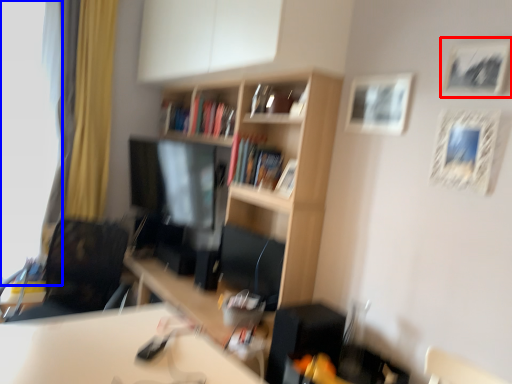
Question: Which of the following is the closest to the observer, picture frame (highlighted by a red box) or window screen (highlighted by a blue box)?

Choices:
 (A) picture frame
 (B) window screen

Answer: (A)